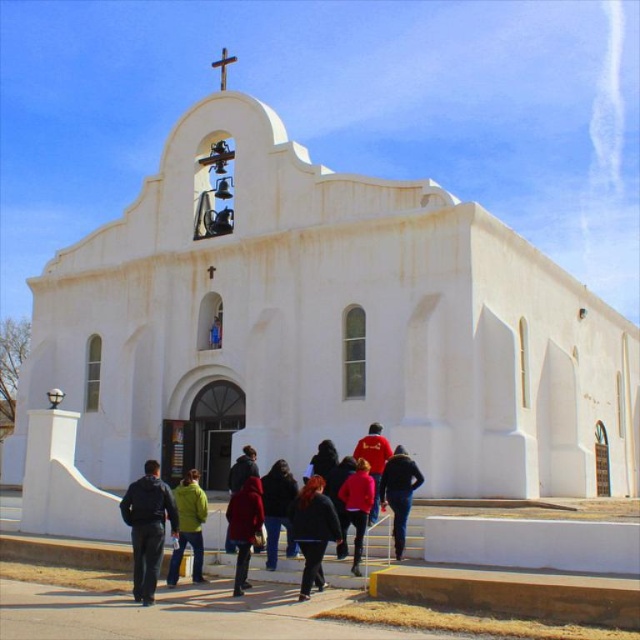
You are standing in front of the church and want to greet the person wearing the dark blue jacket at lower left and the person wearing the matte red coat at center. Which person should you approach first if you want to greet the taller individual?

The dark blue jacket at lower left is taller than the matte red coat at center, so you should approach the person wearing the dark blue jacket at lower left first.

You are a photographer standing in front of the church. You want to take a photo that includes both the dark blue jacket at lower left and the velvet red coat at center. Which object should you adjust your camera angle to focus on first to ensure both are in frame?

The dark blue jacket at lower left is located below the velvet red coat at center. To include both in the frame, adjust your camera angle to focus on the lower area where the dark blue jacket is positioned first, then ensure the velvet red coat at center remains visible in the upper part of the frame.